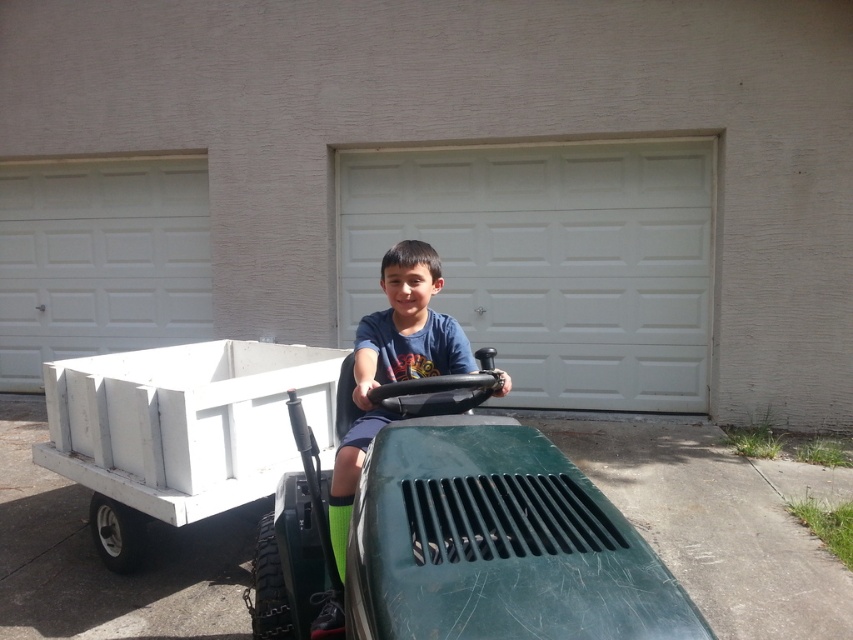
You are a parent trying to take a photo of your child. You want to ensure that both the green matte lawn mower at center and the blue cotton shirt at center are clearly visible in the frame. Based on their positions, which object should you focus on first to ensure both are in focus?

The green matte lawn mower at center is in front of the blue cotton shirt at center, so you should focus on the green matte lawn mower at center first to ensure both are in focus.

You are a delivery person who needs to place a large package in front of the white textured garage door at center without blocking the blue cotton shirt at center. Given their sizes, is this possible?

The white textured garage door at center is larger in size than the blue cotton shirt at center, so yes, placing the large package in front of the white textured garage door at center while keeping it from blocking the blue cotton shirt at center is possible since the garage door is bigger.

You are a parent trying to ensure your child is safely positioned on the green matte lawn mower at center while wearing the blue cotton shirt at center. Based on their positions, is the shirt likely covering the lawn mower?

The green matte lawn mower at center is below the blue cotton shirt at center, so the shirt is likely covering the lawn mower.